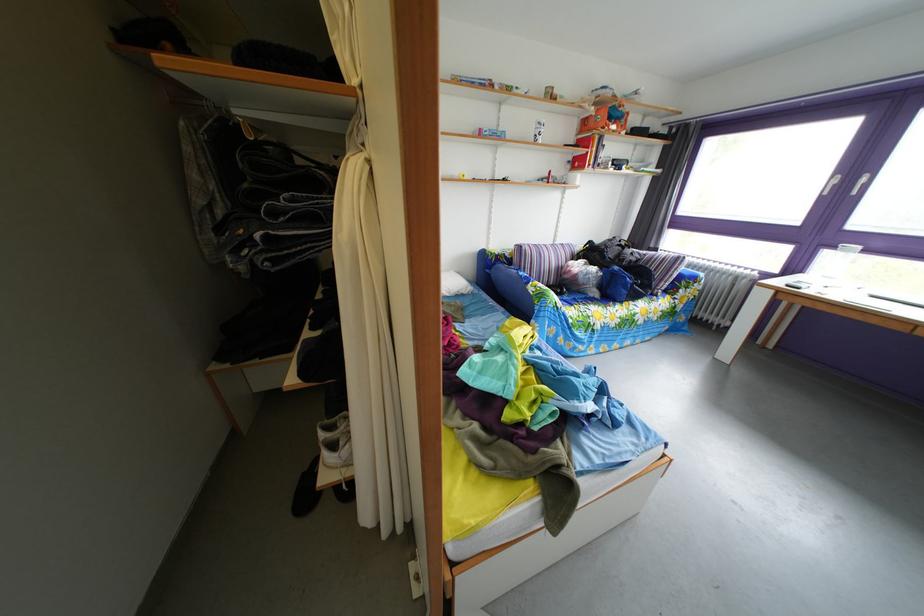
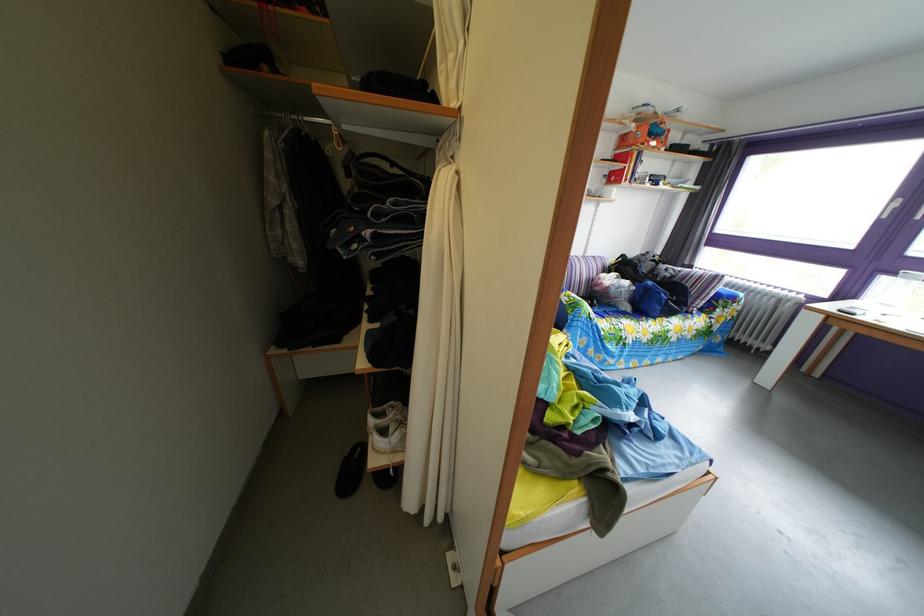
Locate, in the second image, the point that corresponds to point 344,201 in the first image.

(438, 207)